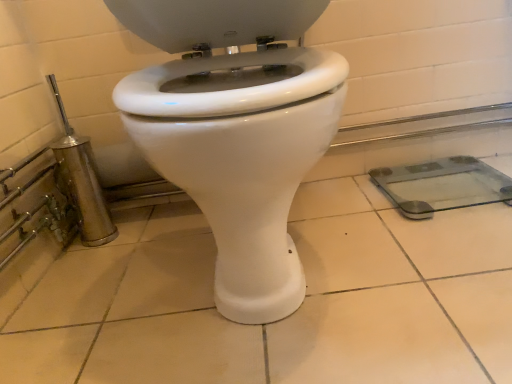
Locate an element on the screen. The height and width of the screenshot is (384, 512). vacant space positioned to the left of transparent glass scale at right is located at coordinates (345, 217).